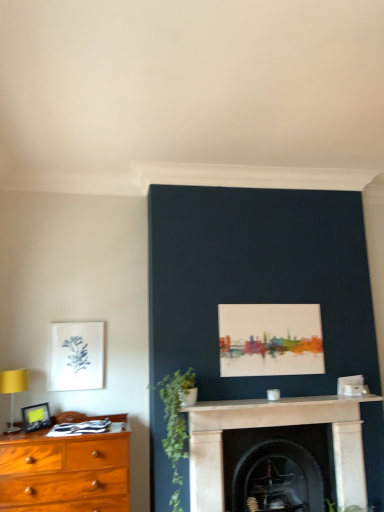
Question: Considering the relative sizes of white marble mantle at center and green matte plant at center-left in the image provided, is white marble mantle at center bigger than green matte plant at center-left?

Choices:
 (A) no
 (B) yes

Answer: (A)

Question: Would you consider white marble mantle at center to be distant from green matte plant at center-left?

Choices:
 (A) yes
 (B) no

Answer: (B)

Question: Considering the relative positions of white marble mantle at center and green matte plant at center-left in the image provided, is white marble mantle at center in front of green matte plant at center-left?

Choices:
 (A) yes
 (B) no

Answer: (B)

Question: Is white marble mantle at center located outside green matte plant at center-left?

Choices:
 (A) yes
 (B) no

Answer: (A)

Question: Is white marble mantle at center at the right side of green matte plant at center-left?

Choices:
 (A) no
 (B) yes

Answer: (B)

Question: Considering their positions, is matte black picture frame at left, which is the 1th picture frame from bottom to top, located in front of or behind matte white picture frame at left, the second picture frame positioned from the front?

Choices:
 (A) front
 (B) behind

Answer: (A)

Question: Considering the positions of point (41, 421) and point (92, 336), is point (41, 421) closer or farther from the camera than point (92, 336)?

Choices:
 (A) closer
 (B) farther

Answer: (A)

Question: Is matte black picture frame at left, which is the 1th picture frame from bottom to top, situated inside matte white picture frame at left, which is the 1th picture frame in top-to-bottom order, or outside?

Choices:
 (A) outside
 (B) inside

Answer: (A)

Question: Based on their sizes in the image, would you say matte black picture frame at left, arranged as the second picture frame when viewed from the back, is bigger or smaller than matte white picture frame at left, the second picture frame positioned from the front?

Choices:
 (A) small
 (B) big

Answer: (A)

Question: From a real-world perspective, is white marble mantle at center above or below white marble fireplace at center, marked as the first fireplace in a front-to-back arrangement?

Choices:
 (A) below
 (B) above

Answer: (B)

Question: Considering the positions of white marble mantle at center and white marble fireplace at center, which appears as the 2th fireplace when viewed from the back, in the image, is white marble mantle at center taller or shorter than white marble fireplace at center, which appears as the 2th fireplace when viewed from the back,?

Choices:
 (A) short
 (B) tall

Answer: (A)

Question: Choose the correct answer: Is white marble mantle at center inside white marble fireplace at center, which appears as the 2th fireplace when viewed from the back, or outside it?

Choices:
 (A) outside
 (B) inside

Answer: (A)

Question: Is white marble mantle at center bigger or smaller than white marble fireplace at center, which appears as the 2th fireplace when viewed from the back?

Choices:
 (A) small
 (B) big

Answer: (A)

Question: From their relative heights in the image, would you say green matte plant at center-left is taller or shorter than dark stone fireplace at center, placed as the second fireplace when sorted from front to back?

Choices:
 (A) tall
 (B) short

Answer: (A)

Question: Based on their positions, is green matte plant at center-left located to the left or right of dark stone fireplace at center, placed as the second fireplace when sorted from front to back?

Choices:
 (A) right
 (B) left

Answer: (B)